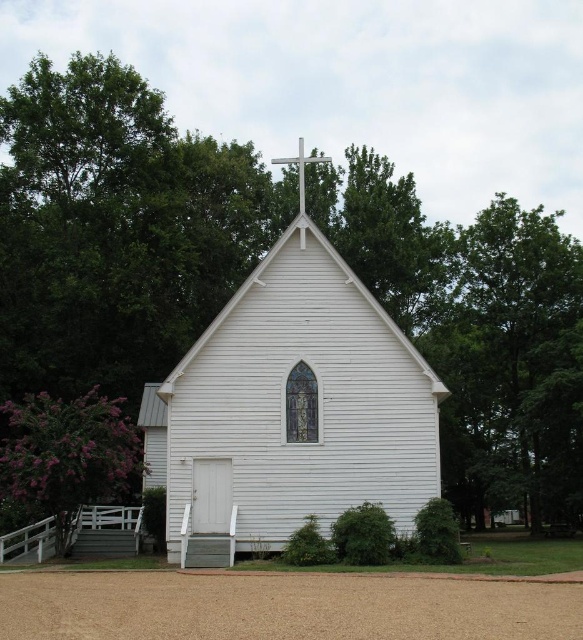
You are standing at the point marked as point (290, 410) in the image. What structure are you currently standing on?

You are standing on the white wood chapel at center.

You are standing on the dirt path leading to the white wood chapel at center and the metallic cross at center. Which object appears taller from your perspective?

The metallic cross at center appears taller than the white wood chapel at center because the white wood chapel at center is not as tall as the metallic cross at center.

You are a landscape architect designing a garden around the white wood chapel at center and the metallic cross at center. If you want to place a flower bed between them, which object should the flower bed be closer to based on their sizes?

The white wood chapel at center is wider than the metallic cross at center, so the flower bed should be closer to the metallic cross at center to balance the sizes.